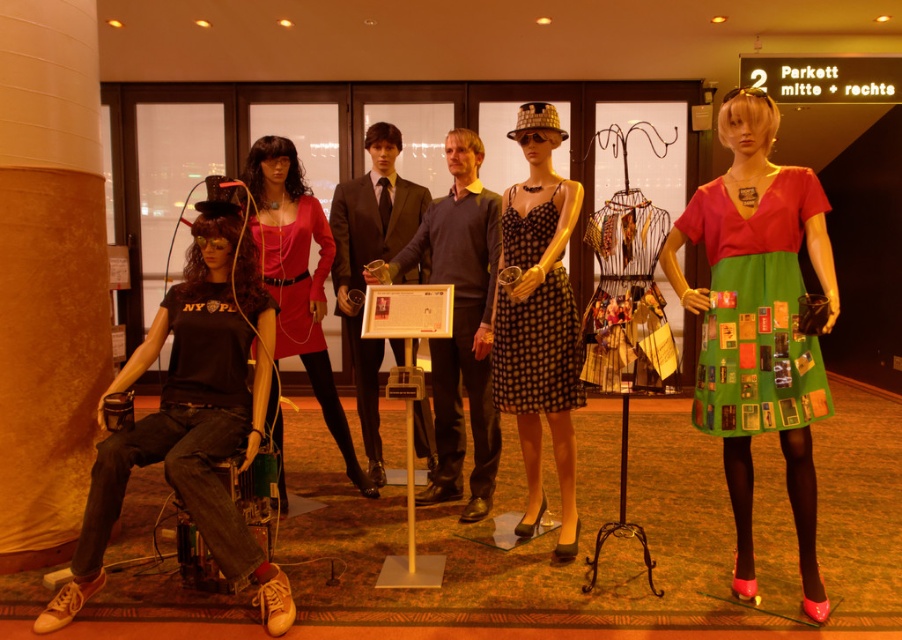
Can you confirm if matte blue sweater at center is wider than shiny black suit at center?

Correct, the width of matte blue sweater at center exceeds that of shiny black suit at center.

Who is positioned more to the left, matte blue sweater at center or shiny black suit at center?

Positioned to the left is shiny black suit at center.

Is point (440, 353) positioned after point (364, 381)?

No, it is in front of (364, 381).

Image resolution: width=902 pixels, height=640 pixels. I want to click on matte blue sweater at center, so click(461, 323).

Does green patchwork dress at right have a lesser height compared to black dotted fabric dress at center?

Yes.

Does green patchwork dress at right appear under black dotted fabric dress at center?

Indeed, green patchwork dress at right is positioned under black dotted fabric dress at center.

What do you see at coordinates (755, 308) in the screenshot?
I see `green patchwork dress at right` at bounding box center [755, 308].

The height and width of the screenshot is (640, 902). I want to click on green patchwork dress at right, so tap(755, 308).

Does matte black t-shirt at left have a lesser width compared to black dotted fabric dress at center?

No, matte black t-shirt at left is not thinner than black dotted fabric dress at center.

Does point (200, 228) come farther from viewer compared to point (555, 284)?

No, it is not.

The image size is (902, 640). I want to click on matte black t-shirt at left, so click(x=192, y=417).